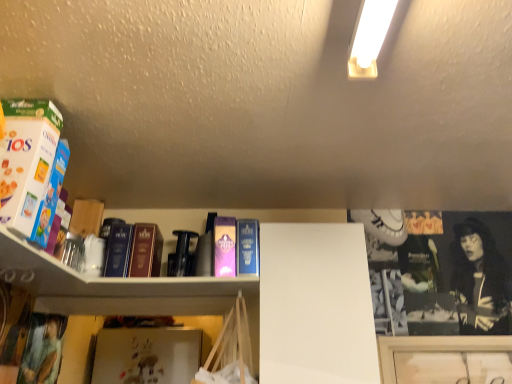
Question: From a real-world perspective, is matte purple book at left, which is the 2th book in front-to-back order, positioned under hardcover book at center, the second paperback book when ordered from left to right, based on gravity?

Choices:
 (A) yes
 (B) no

Answer: (A)

Question: Is matte purple book at left, the 3th book when ordered from back to front, outside hardcover book at center, which is the first paperback book in right-to-left order?

Choices:
 (A) yes
 (B) no

Answer: (A)

Question: Are matte purple book at left, the 3th book when ordered from back to front, and hardcover book at center, which is the first paperback book in right-to-left order, located far from each other?

Choices:
 (A) yes
 (B) no

Answer: (B)

Question: From a real-world perspective, does matte purple book at left, which is the 2th book in front-to-back order, stand above hardcover book at center, which is the first paperback book in right-to-left order?

Choices:
 (A) yes
 (B) no

Answer: (B)

Question: Does matte purple book at left, which is the 2th book in front-to-back order, have a smaller size compared to hardcover book at center, which is the first paperback book in right-to-left order?

Choices:
 (A) yes
 (B) no

Answer: (A)

Question: Looking at the image, does hardcover book at center, which is counted as the 1th book, starting from the back, seem bigger or smaller compared to purple matte paperback book at center, positioned as the second paperback book in right-to-left order?

Choices:
 (A) big
 (B) small

Answer: (B)

Question: In terms of height, does hardcover book at center, which is counted as the 1th book, starting from the back, look taller or shorter compared to purple matte paperback book at center, positioned as the second paperback book in right-to-left order?

Choices:
 (A) short
 (B) tall

Answer: (A)

Question: Is hardcover book at center, which is counted as the 1th book, starting from the back, inside or outside of purple matte paperback book at center, positioned as the second paperback book in right-to-left order?

Choices:
 (A) inside
 (B) outside

Answer: (B)

Question: Considering the relative positions of hardcover book at center, which is counted as the 1th book, starting from the back, and purple matte paperback book at center, the first paperback book positioned from the left, in the image provided, is hardcover book at center, which is counted as the 1th book, starting from the back, to the left or to the right of purple matte paperback book at center, the first paperback book positioned from the left,?

Choices:
 (A) right
 (B) left

Answer: (B)

Question: In the image, is matte purple book at left, which is the 2th book in front-to-back order, positioned in front of or behind hardcover book at center, the second paperback book when ordered from left to right?

Choices:
 (A) front
 (B) behind

Answer: (A)

Question: Based on their sizes in the image, would you say matte purple book at left, which is the 2th book in front-to-back order, is bigger or smaller than hardcover book at center, the second paperback book when ordered from left to right?

Choices:
 (A) small
 (B) big

Answer: (A)

Question: Considering the positions of matte purple book at left, which is the 2th book in front-to-back order, and hardcover book at center, the second paperback book when ordered from left to right, in the image, is matte purple book at left, which is the 2th book in front-to-back order, wider or thinner than hardcover book at center, the second paperback book when ordered from left to right,?

Choices:
 (A) wide
 (B) thin

Answer: (B)

Question: From a real-world perspective, is matte purple book at left, the 3th book when ordered from back to front, physically located above or below hardcover book at center, the second paperback book when ordered from left to right?

Choices:
 (A) below
 (B) above

Answer: (A)

Question: From a real-world perspective, relative to matte purple book at left, which is the 2th book in front-to-back order, is blue cardboard cereal box at left, positioned as the 1th book in front-to-back order, vertically above or below?

Choices:
 (A) above
 (B) below

Answer: (A)

Question: Relative to matte purple book at left, which is the 2th book in front-to-back order, is blue cardboard cereal box at left, positioned as the 1th book in front-to-back order, in front or behind?

Choices:
 (A) front
 (B) behind

Answer: (A)